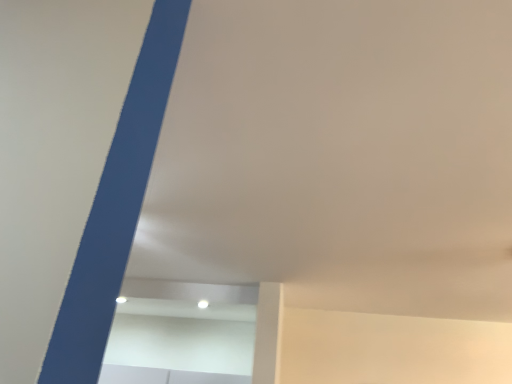
What is the approximate width of blue painted beam at upper left?

It is 2.88 meters.

Locate an element on the screen. Image resolution: width=512 pixels, height=384 pixels. blue painted beam at upper left is located at coordinates (116, 207).

The height and width of the screenshot is (384, 512). Describe the element at coordinates (116, 207) in the screenshot. I see `blue painted beam at upper left` at that location.

The height and width of the screenshot is (384, 512). I want to click on blue painted beam at upper left, so click(116, 207).